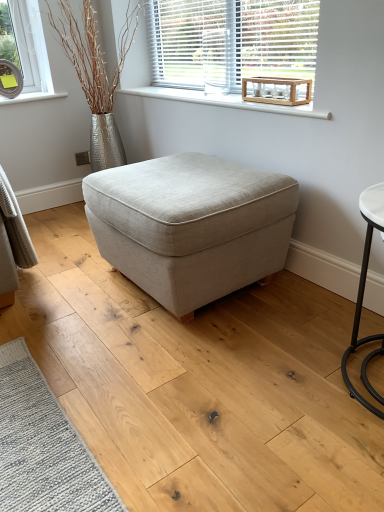
Question: Would you say white smooth window sill at upper center is outside wooden crate at upper center?

Choices:
 (A) no
 (B) yes

Answer: (B)

Question: Considering the relative sizes of white smooth window sill at upper center and wooden crate at upper center in the image provided, is white smooth window sill at upper center bigger than wooden crate at upper center?

Choices:
 (A) yes
 (B) no

Answer: (B)

Question: Does white smooth window sill at upper center appear on the right side of wooden crate at upper center?

Choices:
 (A) no
 (B) yes

Answer: (A)

Question: Is white smooth window sill at upper center positioned with its back to wooden crate at upper center?

Choices:
 (A) no
 (B) yes

Answer: (A)

Question: Is white smooth window sill at upper center directly adjacent to wooden crate at upper center?

Choices:
 (A) no
 (B) yes

Answer: (A)

Question: Considering the positions of wooden crate at upper center and white smooth window sill at upper center in the image, is wooden crate at upper center bigger or smaller than white smooth window sill at upper center?

Choices:
 (A) big
 (B) small

Answer: (A)

Question: From the image's perspective, is wooden crate at upper center positioned above or below white smooth window sill at upper center?

Choices:
 (A) below
 (B) above

Answer: (B)

Question: Considering the positions of point (188, 31) and point (173, 94), is point (188, 31) closer or farther from the camera than point (173, 94)?

Choices:
 (A) farther
 (B) closer

Answer: (A)

Question: From a real-world perspective, is wooden crate at upper center positioned above or below white smooth window sill at upper center?

Choices:
 (A) below
 (B) above

Answer: (B)

Question: Considering the positions of wooden crate at upper center and clear glass round table at upper right in the image, is wooden crate at upper center taller or shorter than clear glass round table at upper right?

Choices:
 (A) short
 (B) tall

Answer: (B)

Question: In terms of size, does wooden crate at upper center appear bigger or smaller than clear glass round table at upper right?

Choices:
 (A) small
 (B) big

Answer: (B)

Question: In terms of width, does wooden crate at upper center look wider or thinner when compared to clear glass round table at upper right?

Choices:
 (A) thin
 (B) wide

Answer: (A)

Question: Is point (163, 83) closer or farther from the camera than point (253, 90)?

Choices:
 (A) farther
 (B) closer

Answer: (A)

Question: From the image's perspective, is white smooth window sill at upper center above or below clear glass round table at upper right?

Choices:
 (A) above
 (B) below

Answer: (A)

Question: In the image, is white smooth window sill at upper center on the left side or the right side of clear glass round table at upper right?

Choices:
 (A) right
 (B) left

Answer: (B)